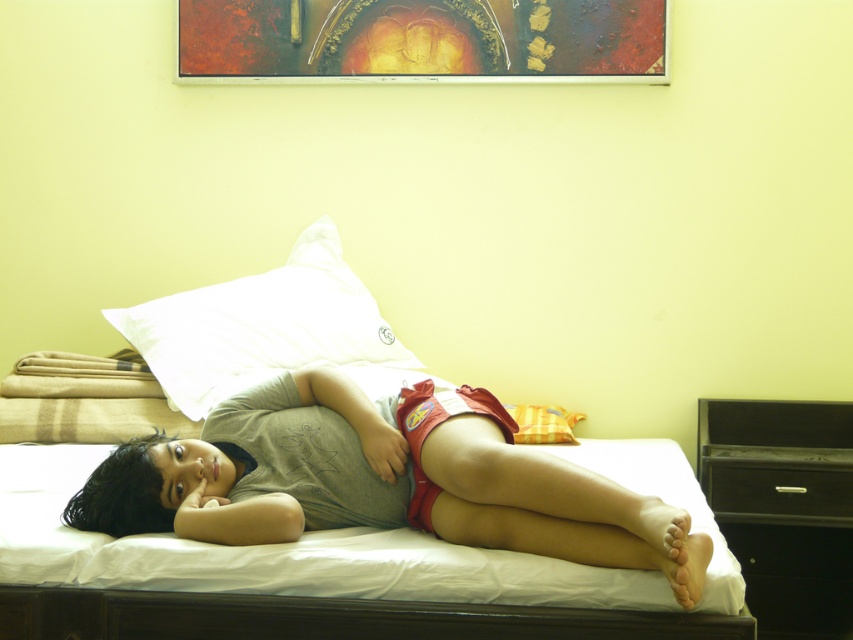
Based on the photo, you are taking a photo of the scene and want to focus on both the point at coordinates point(x=202, y=358) and point(x=749, y=509). Which point should you focus on first to ensure both are in focus?

You should focus on point(x=202, y=358) first because it is closer to the camera than point(x=749, y=509), so focusing on the closer point will help ensure both are in focus.